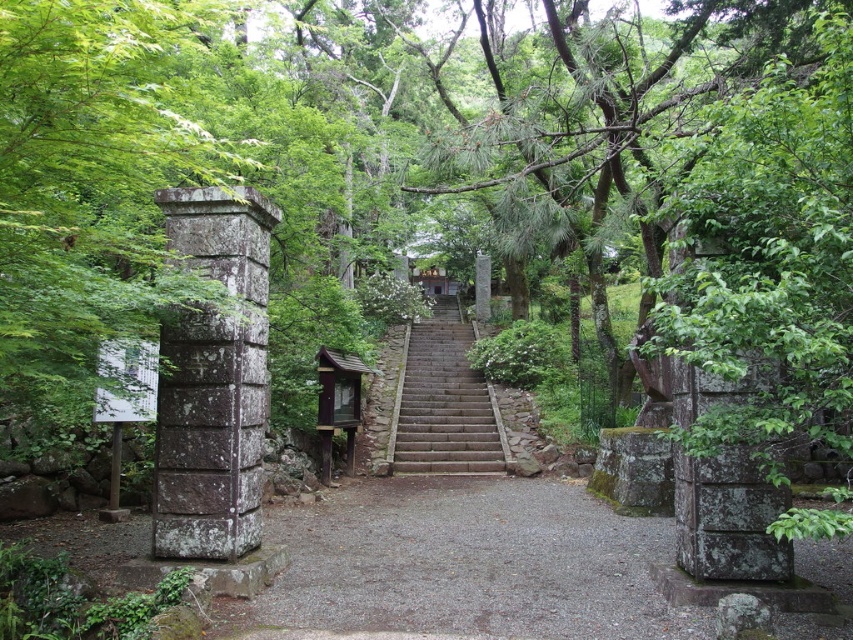
You are standing at the base of the stone steps leading to the temple. You see two points marked in the scene. One is at coordinate point (679,628) and the other at point (444,435). If you were to walk towards the temple, which point would you encounter first?

Point (679,628) is in front of point (444,435), so you would encounter point (679,628) first as you walk towards the temple.

You are standing at the entrance of the temple and want to walk along the path. Where exactly is the gray gravel path at center located in this scene?

The gray gravel path at center is located at the coordinates point (467, 564).

You are a tourist visiting this traditional Japanese site and need to walk up the brown stone stairs at center. However, you notice a gray gravel path at center nearby. Which path is narrower between the two?

The gray gravel path at center is thinner than the brown stone stairs at center, so the gray gravel path at center is narrower between the two.